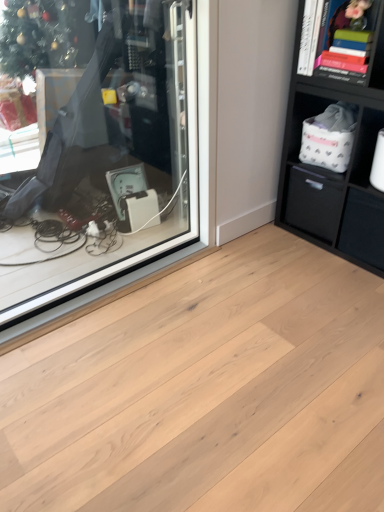
Locate an element on the screen. The width and height of the screenshot is (384, 512). vacant space underneath white fabric basket at right, which appears as the 1th cabinet when ordered from the bottom (from a real-world perspective) is located at coordinates (370, 187).